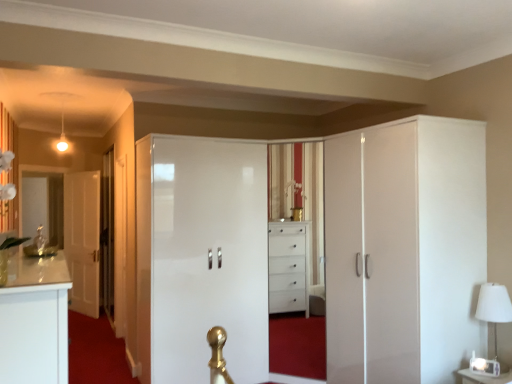
Question: Can you confirm if glossy white wardrobe at center, which ranks as the second door in left-to-right order, is taller than transparent glass door at left?

Choices:
 (A) no
 (B) yes

Answer: (A)

Question: Is the position of glossy white wardrobe at center, acting as the 1th door starting from the right, more distant than that of transparent glass door at left?

Choices:
 (A) yes
 (B) no

Answer: (B)

Question: Is glossy white wardrobe at center, acting as the 1th door starting from the right, positioned beyond the bounds of transparent glass door at left?

Choices:
 (A) no
 (B) yes

Answer: (B)

Question: Considering the relative sizes of glossy white wardrobe at center, acting as the 1th door starting from the right, and transparent glass door at left in the image provided, is glossy white wardrobe at center, acting as the 1th door starting from the right, smaller than transparent glass door at left?

Choices:
 (A) no
 (B) yes

Answer: (A)

Question: Considering the relative positions of glossy white wardrobe at center, which appears as the second door when viewed from the back, and transparent glass door at left in the image provided, is glossy white wardrobe at center, which appears as the second door when viewed from the back, to the left of transparent glass door at left from the viewer's perspective?

Choices:
 (A) no
 (B) yes

Answer: (A)

Question: Considering the positions of glossy white wardrobe at center, which ranks as the first door in front-to-back order, and white glossy dresser at center in the image, is glossy white wardrobe at center, which ranks as the first door in front-to-back order, wider or thinner than white glossy dresser at center?

Choices:
 (A) thin
 (B) wide

Answer: (A)

Question: Is glossy white wardrobe at center, acting as the 1th door starting from the right, bigger or smaller than white glossy dresser at center?

Choices:
 (A) small
 (B) big

Answer: (A)

Question: In the image, is glossy white wardrobe at center, which appears as the second door when viewed from the back, on the left side or the right side of white glossy dresser at center?

Choices:
 (A) left
 (B) right

Answer: (A)

Question: Considering their positions, is glossy white wardrobe at center, which appears as the second door when viewed from the back, located in front of or behind white glossy dresser at center?

Choices:
 (A) front
 (B) behind

Answer: (B)

Question: In terms of width, does white glossy cupboard at right look wider or thinner when compared to white glossy dresser at center?

Choices:
 (A) wide
 (B) thin

Answer: (B)

Question: Is white glossy cupboard at right spatially inside white glossy dresser at center, or outside of it?

Choices:
 (A) outside
 (B) inside

Answer: (A)

Question: From a real-world perspective, is white glossy cupboard at right physically located above or below white glossy dresser at center?

Choices:
 (A) above
 (B) below

Answer: (A)

Question: In the image, is white glossy cupboard at right positioned in front of or behind white glossy dresser at center?

Choices:
 (A) behind
 (B) front

Answer: (A)

Question: Based on their sizes in the image, would you say white glossy door at left, which is counted as the 2th door, starting from the right, is bigger or smaller than white glossy cupboard at right?

Choices:
 (A) small
 (B) big

Answer: (A)

Question: Is white glossy door at left, which is counted as the 2th door, starting from the right, taller or shorter than white glossy cupboard at right?

Choices:
 (A) short
 (B) tall

Answer: (A)